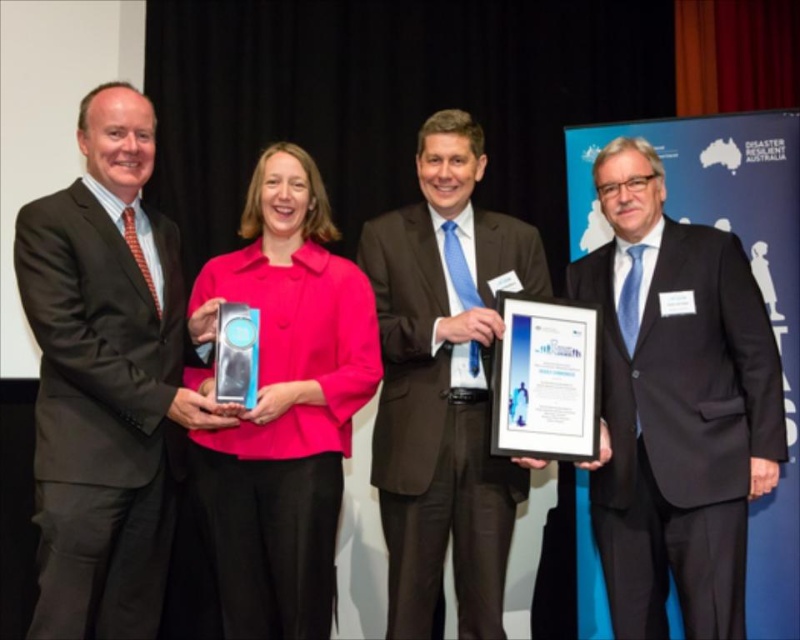
You are a photographer at an awards ceremony. You need to capture a photo of the two people wearing matte black suits. The camera you are using has a minimum focus distance of 30 inches. Will you be able to focus on both individuals wearing the matte black suit at left and the matte black suit at center?

The matte black suit at left and matte black suit at center are 32.06 inches apart. Since the minimum focus distance is 30 inches, the camera can focus on both individuals as the distance between them is within the required range.